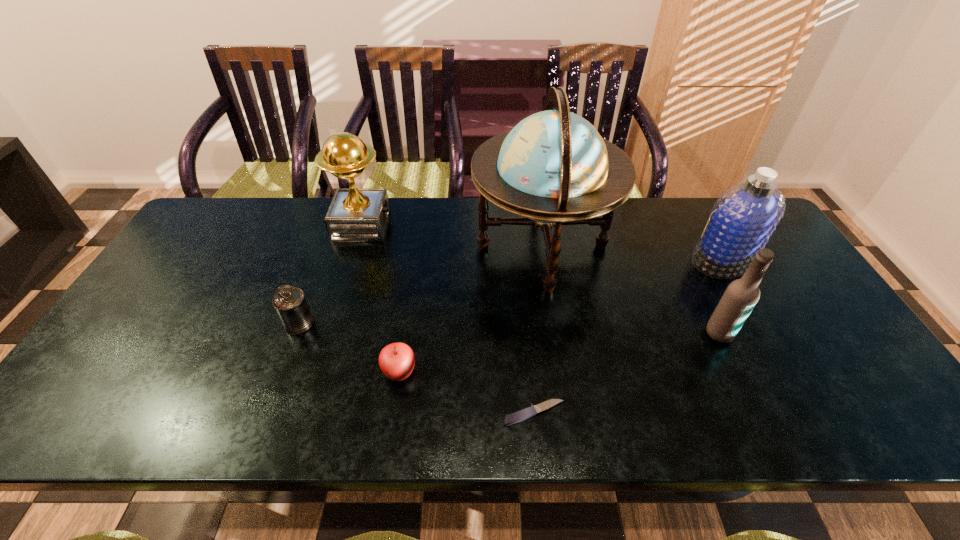
Locate an element on the screen. Image resolution: width=960 pixels, height=540 pixels. cleansing agent that is at the far edge is located at coordinates (742, 220).

In order to click on object that is positioned at the near edge in this screenshot , I will do `click(529, 412)`.

The width and height of the screenshot is (960, 540). What are the coordinates of `object located in the right edge section of the desktop` in the screenshot? It's located at (742, 220).

Where is `object present at the far right corner`? object present at the far right corner is located at coordinates (742, 220).

Where is `vacant area at the far edge of the desktop`? vacant area at the far edge of the desktop is located at coordinates click(x=323, y=214).

The image size is (960, 540). I want to click on free region at the near edge of the desktop, so click(603, 435).

This screenshot has height=540, width=960. In the image, there is a desktop. Find the location of `vacant space at the left edge`. vacant space at the left edge is located at coordinates (194, 299).

Image resolution: width=960 pixels, height=540 pixels. What are the coordinates of `vacant region at the right edge of the desktop` in the screenshot? It's located at (794, 286).

Identify the location of free space at the near right corner of the desktop. (865, 411).

Identify the location of vacant space in between the sixth tallest object and the cleansing agent. The width and height of the screenshot is (960, 540). (561, 316).